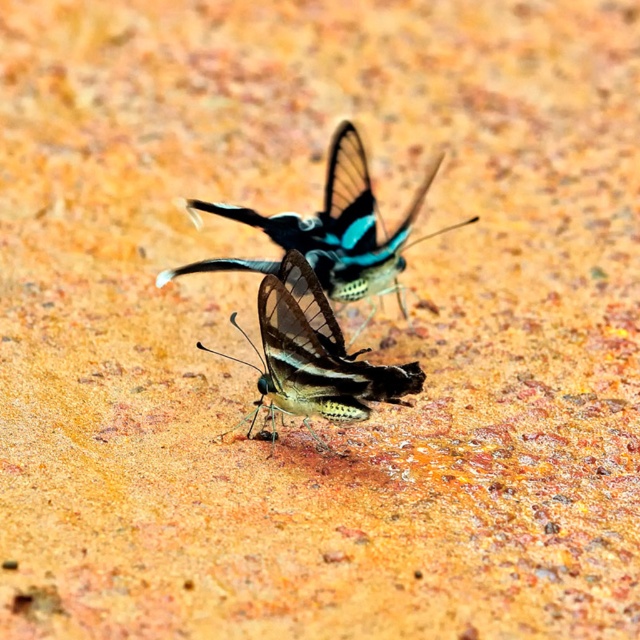
Question: Does shiny metallic butterfly at center appear over shiny blue butterfly at center?

Choices:
 (A) yes
 (B) no

Answer: (B)

Question: Which of the following is the farthest from the observer?

Choices:
 (A) shiny metallic butterfly at center
 (B) shiny blue butterfly at center

Answer: (B)

Question: Is shiny metallic butterfly at center closer to the viewer compared to shiny blue butterfly at center?

Choices:
 (A) no
 (B) yes

Answer: (B)

Question: Which point is closer to the camera?

Choices:
 (A) (356, 276)
 (B) (369, 406)

Answer: (B)

Question: Is shiny metallic butterfly at center positioned before shiny blue butterfly at center?

Choices:
 (A) yes
 (B) no

Answer: (A)